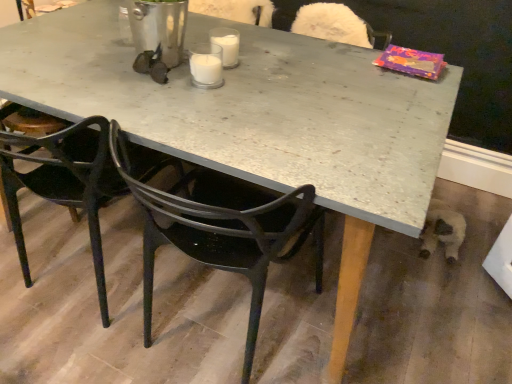
Measure the distance between matte black chair at lower left, arranged as the 1th chair when viewed from the left, and camera.

3.36 feet.

What are the coordinates of `white glass candle at center, the second coffee cup positioned from the back` in the screenshot? It's located at (206, 65).

The width and height of the screenshot is (512, 384). In order to click on white glass at center, the 1th coffee cup in the back-to-front sequence in this screenshot , I will do `click(226, 45)`.

Locate an element on the screen. This screenshot has width=512, height=384. matte black chair at lower left, arranged as the 1th chair when viewed from the left is located at coordinates (65, 183).

Between white glass candle at center, which is the first coffee cup in front-to-back order, and white glass at center, the 2th coffee cup in the front-to-back sequence, which one is positioned in front?

white glass candle at center, which is the first coffee cup in front-to-back order.

From the picture: Is white glass at center, the 1th coffee cup in the back-to-front sequence, completely or partially inside white glass candle at center, which is the first coffee cup in front-to-back order?

No, white glass at center, the 1th coffee cup in the back-to-front sequence, is not a part of white glass candle at center, which is the first coffee cup in front-to-back order.

Could you tell me if white glass candle at center, the second coffee cup positioned from the back, is turned towards white glass at center, the 1th coffee cup in the back-to-front sequence?

No, white glass candle at center, the second coffee cup positioned from the back, is not facing towards white glass at center, the 1th coffee cup in the back-to-front sequence.

Is point (192, 73) positioned after point (216, 44)?

No, it is in front of (216, 44).

From the picture: Does matte black chair at lower left, marked as the 2th chair in a right-to-left arrangement, appear on the right side of black plastic chair at center, which is counted as the 1th chair, starting from the right?

In fact, matte black chair at lower left, marked as the 2th chair in a right-to-left arrangement, is to the left of black plastic chair at center, which is counted as the 1th chair, starting from the right.

From a real-world perspective, which object stands above the other?

matte black chair at lower left, marked as the 2th chair in a right-to-left arrangement, is physically above.

Which of these two, matte black chair at lower left, arranged as the 1th chair when viewed from the left, or black plastic chair at center, which ranks as the 2th chair in left-to-right order, is thinner?

black plastic chair at center, which ranks as the 2th chair in left-to-right order.

Can you tell me how much matte black chair at lower left, arranged as the 1th chair when viewed from the left, and black plastic chair at center, which is counted as the 1th chair, starting from the right, differ in facing direction?

They differ by 0.000461 degrees in their facing directions.

Is matte black chair at lower left, arranged as the 1th chair when viewed from the left, facing away from white glass candle at center, which is the first coffee cup in front-to-back order?

Result: matte black chair at lower left, arranged as the 1th chair when viewed from the left, is not turned away from white glass candle at center, which is the first coffee cup in front-to-back order.

Does point (102, 172) come closer to viewer compared to point (206, 61)?

Yes, point (102, 172) is closer to viewer.

Does matte black chair at lower left, arranged as the 1th chair when viewed from the left, have a larger size compared to white glass candle at center, which is the first coffee cup in front-to-back order?

Indeed, matte black chair at lower left, arranged as the 1th chair when viewed from the left, has a larger size compared to white glass candle at center, which is the first coffee cup in front-to-back order.

How many degrees apart are the facing directions of matte black chair at lower left, arranged as the 1th chair when viewed from the left, and white glass candle at center, which is the first coffee cup in front-to-back order?

They differ by 180 degrees in their facing directions.

Who is bigger, white glass at center, the 1th coffee cup in the back-to-front sequence, or matte black chair at lower left, marked as the 2th chair in a right-to-left arrangement?

matte black chair at lower left, marked as the 2th chair in a right-to-left arrangement.

From the image's perspective, between white glass at center, the 1th coffee cup in the back-to-front sequence, and matte black chair at lower left, marked as the 2th chair in a right-to-left arrangement, who is located below?

matte black chair at lower left, marked as the 2th chair in a right-to-left arrangement, from the image's perspective.

Is white glass at center, the 2th coffee cup in the front-to-back sequence, not inside matte black chair at lower left, arranged as the 1th chair when viewed from the left?

Indeed, white glass at center, the 2th coffee cup in the front-to-back sequence, is completely outside matte black chair at lower left, arranged as the 1th chair when viewed from the left.

From a real-world perspective, is white glass at center, the 1th coffee cup in the back-to-front sequence, positioned under matte black chair at lower left, arranged as the 1th chair when viewed from the left, based on gravity?

Actually, white glass at center, the 1th coffee cup in the back-to-front sequence, is physically above matte black chair at lower left, arranged as the 1th chair when viewed from the left, in the real world.

Is white glass candle at center, which is the first coffee cup in front-to-back order, not inside matte black chair at lower left, arranged as the 1th chair when viewed from the left?

white glass candle at center, which is the first coffee cup in front-to-back order, lies outside matte black chair at lower left, arranged as the 1th chair when viewed from the left,'s area.

Considering the sizes of objects white glass candle at center, which is the first coffee cup in front-to-back order, and matte black chair at lower left, arranged as the 1th chair when viewed from the left, in the image provided, who is shorter, white glass candle at center, which is the first coffee cup in front-to-back order, or matte black chair at lower left, arranged as the 1th chair when viewed from the left,?

white glass candle at center, which is the first coffee cup in front-to-back order.

Considering the positions of objects white glass candle at center, which is the first coffee cup in front-to-back order, and matte black chair at lower left, arranged as the 1th chair when viewed from the left, in the image provided, who is more to the left, white glass candle at center, which is the first coffee cup in front-to-back order, or matte black chair at lower left, arranged as the 1th chair when viewed from the left,?

matte black chair at lower left, arranged as the 1th chair when viewed from the left, is more to the left.

Who is bigger, white glass candle at center, which is the first coffee cup in front-to-back order, or matte black chair at lower left, marked as the 2th chair in a right-to-left arrangement?

With larger size is matte black chair at lower left, marked as the 2th chair in a right-to-left arrangement.

Identify the location of the 2nd chair below the white glass at center, the 1th coffee cup in the back-to-front sequence (from a real-world perspective). This screenshot has width=512, height=384. (220, 227).

Looking at this image, could you tell me if black plastic chair at center, which is counted as the 1th chair, starting from the right, is facing white glass at center, the 2th coffee cup in the front-to-back sequence?

Yes, black plastic chair at center, which is counted as the 1th chair, starting from the right, faces towards white glass at center, the 2th coffee cup in the front-to-back sequence.

Considering the positions of points (260, 292) and (215, 33), is point (260, 292) farther from camera compared to point (215, 33)?

No, (260, 292) is in front of (215, 33).

Does black plastic chair at center, which is counted as the 1th chair, starting from the right, appear on the left side of white glass at center, the 2th coffee cup in the front-to-back sequence?

No.

Who is bigger, black plastic chair at center, which is counted as the 1th chair, starting from the right, or matte black chair at lower left, arranged as the 1th chair when viewed from the left?

matte black chair at lower left, arranged as the 1th chair when viewed from the left, is bigger.

Can you tell me how much black plastic chair at center, which ranks as the 2th chair in left-to-right order, and matte black chair at lower left, arranged as the 1th chair when viewed from the left, differ in facing direction?

The angle between the facing direction of black plastic chair at center, which ranks as the 2th chair in left-to-right order, and the facing direction of matte black chair at lower left, arranged as the 1th chair when viewed from the left, is 0.000461 degrees.

Is black plastic chair at center, which ranks as the 2th chair in left-to-right order, facing towards matte black chair at lower left, marked as the 2th chair in a right-to-left arrangement?

No, black plastic chair at center, which ranks as the 2th chair in left-to-right order, is not aimed at matte black chair at lower left, marked as the 2th chair in a right-to-left arrangement.

Considering the sizes of black plastic chair at center, which is counted as the 1th chair, starting from the right, and matte black chair at lower left, marked as the 2th chair in a right-to-left arrangement, in the image, is black plastic chair at center, which is counted as the 1th chair, starting from the right, taller or shorter than matte black chair at lower left, marked as the 2th chair in a right-to-left arrangement,?

black plastic chair at center, which is counted as the 1th chair, starting from the right, is taller than matte black chair at lower left, marked as the 2th chair in a right-to-left arrangement.

Where is `coffee cup to the left of white glass at center, the 2th coffee cup in the front-to-back sequence`? The image size is (512, 384). coffee cup to the left of white glass at center, the 2th coffee cup in the front-to-back sequence is located at coordinates (206, 65).

Where is `chair located behind the black plastic chair at center, which is counted as the 1th chair, starting from the right`? This screenshot has height=384, width=512. chair located behind the black plastic chair at center, which is counted as the 1th chair, starting from the right is located at coordinates (65, 183).

Based on their spatial positions, is white glass candle at center, the second coffee cup positioned from the back, or matte black chair at lower left, marked as the 2th chair in a right-to-left arrangement, further from white glass at center, the 1th coffee cup in the back-to-front sequence?

matte black chair at lower left, marked as the 2th chair in a right-to-left arrangement.

Which object lies further to the anchor point matte black chair at lower left, arranged as the 1th chair when viewed from the left, white glass candle at center, the second coffee cup positioned from the back, or black plastic chair at center, which ranks as the 2th chair in left-to-right order?

white glass candle at center, the second coffee cup positioned from the back, is further to matte black chair at lower left, arranged as the 1th chair when viewed from the left.

Estimate the real-world distances between objects in this image. Which object is closer to matte black chair at lower left, marked as the 2th chair in a right-to-left arrangement, black plastic chair at center, which is counted as the 1th chair, starting from the right, or white glass at center, the 1th coffee cup in the back-to-front sequence?

Among the two, black plastic chair at center, which is counted as the 1th chair, starting from the right, is located nearer to matte black chair at lower left, marked as the 2th chair in a right-to-left arrangement.

Considering their positions, is black plastic chair at center, which is counted as the 1th chair, starting from the right, positioned closer to matte black chair at lower left, marked as the 2th chair in a right-to-left arrangement, than white glass candle at center, the second coffee cup positioned from the back?

black plastic chair at center, which is counted as the 1th chair, starting from the right, is positioned closer to the anchor matte black chair at lower left, marked as the 2th chair in a right-to-left arrangement.

Based on their spatial positions, is matte black chair at lower left, marked as the 2th chair in a right-to-left arrangement, or white glass candle at center, the second coffee cup positioned from the back, further from white glass at center, the 1th coffee cup in the back-to-front sequence?

matte black chair at lower left, marked as the 2th chair in a right-to-left arrangement, lies further to white glass at center, the 1th coffee cup in the back-to-front sequence, than the other object.

Based on their spatial positions, is matte black chair at lower left, arranged as the 1th chair when viewed from the left, or black plastic chair at center, which is counted as the 1th chair, starting from the right, closer to white glass candle at center, which is the first coffee cup in front-to-back order?

The object closer to white glass candle at center, which is the first coffee cup in front-to-back order, is black plastic chair at center, which is counted as the 1th chair, starting from the right.

From the image, which object appears to be farther from matte black chair at lower left, arranged as the 1th chair when viewed from the left, white glass at center, the 1th coffee cup in the back-to-front sequence, or white glass candle at center, which is the first coffee cup in front-to-back order?

white glass at center, the 1th coffee cup in the back-to-front sequence, is positioned further to the anchor matte black chair at lower left, arranged as the 1th chair when viewed from the left.

Estimate the real-world distances between objects in this image. Which object is closer to white glass candle at center, the second coffee cup positioned from the back, white glass at center, the 2th coffee cup in the front-to-back sequence, or matte black chair at lower left, marked as the 2th chair in a right-to-left arrangement?

white glass at center, the 2th coffee cup in the front-to-back sequence, lies closer to white glass candle at center, the second coffee cup positioned from the back, than the other object.

The image size is (512, 384). I want to click on chair between white glass at center, the 1th coffee cup in the back-to-front sequence, and black plastic chair at center, which ranks as the 2th chair in left-to-right order, from top to bottom, so click(65, 183).

At what (x,y) coordinates should I click in order to perform the action: click on chair between white glass candle at center, which is the first coffee cup in front-to-back order, and black plastic chair at center, which is counted as the 1th chair, starting from the right, in the up-down direction. Please return your answer as a coordinate pair (x, y). This screenshot has width=512, height=384. Looking at the image, I should click on (65, 183).

Locate an element on the screen. The image size is (512, 384). coffee cup between matte black chair at lower left, marked as the 2th chair in a right-to-left arrangement, and white glass at center, the 1th coffee cup in the back-to-front sequence, in the horizontal direction is located at coordinates (206, 65).

Find the location of a particular element. This screenshot has height=384, width=512. coffee cup between white glass at center, the 1th coffee cup in the back-to-front sequence, and black plastic chair at center, which ranks as the 2th chair in left-to-right order, in the vertical direction is located at coordinates (206, 65).